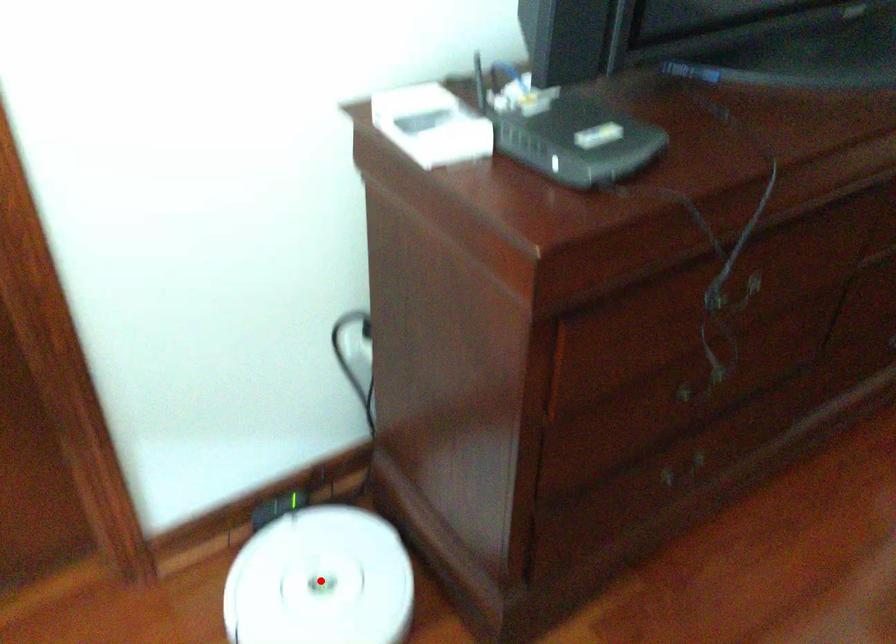
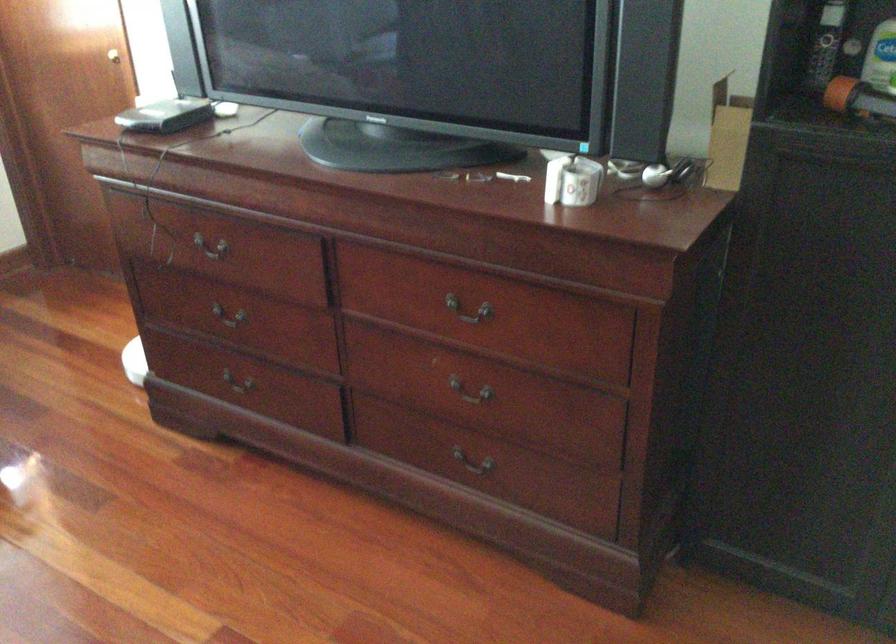
Question: I am providing you with two images of the same scene from different viewpoints. A red point is marked on the first image. Is the red point's position out of view in image 2?

Choices:
 (A) Yes
 (B) No

Answer: (A)